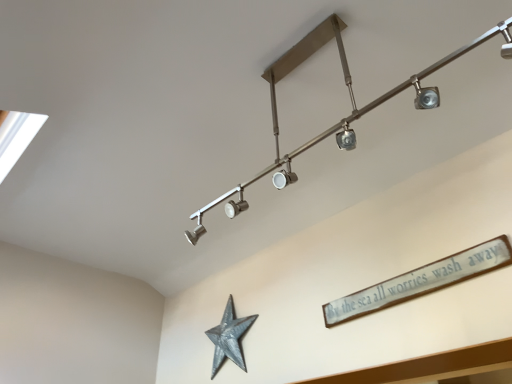
Question: Is the depth of galvanized metal star at lower center greater than that of satin nickel track light at upper center?

Choices:
 (A) yes
 (B) no

Answer: (A)

Question: Is galvanized metal star at lower center thinner than satin nickel track light at upper center?

Choices:
 (A) yes
 (B) no

Answer: (A)

Question: Does galvanized metal star at lower center turn towards satin nickel track light at upper center?

Choices:
 (A) yes
 (B) no

Answer: (B)

Question: From the image's perspective, is galvanized metal star at lower center above satin nickel track light at upper center?

Choices:
 (A) no
 (B) yes

Answer: (A)

Question: Does galvanized metal star at lower center appear on the left side of satin nickel track light at upper center?

Choices:
 (A) yes
 (B) no

Answer: (A)

Question: Would you say white wooden sign at upper right is to the left or to the right of satin nickel track light at upper center in the picture?

Choices:
 (A) left
 (B) right

Answer: (B)

Question: From the image's perspective, is white wooden sign at upper right positioned above or below satin nickel track light at upper center?

Choices:
 (A) above
 (B) below

Answer: (B)

Question: From a real-world perspective, is white wooden sign at upper right above or below satin nickel track light at upper center?

Choices:
 (A) below
 (B) above

Answer: (A)

Question: Is white wooden sign at upper right situated inside satin nickel track light at upper center or outside?

Choices:
 (A) outside
 (B) inside

Answer: (A)

Question: Based on their positions, is galvanized metal star at lower center located to the left or right of white wooden sign at upper right?

Choices:
 (A) left
 (B) right

Answer: (A)

Question: From the image's perspective, is galvanized metal star at lower center above or below white wooden sign at upper right?

Choices:
 (A) above
 (B) below

Answer: (B)

Question: Considering their positions, is galvanized metal star at lower center located in front of or behind white wooden sign at upper right?

Choices:
 (A) behind
 (B) front

Answer: (A)

Question: In terms of height, does galvanized metal star at lower center look taller or shorter compared to white wooden sign at upper right?

Choices:
 (A) tall
 (B) short

Answer: (A)

Question: Is satin nickel track light at upper center to the left or to the right of galvanized metal star at lower center in the image?

Choices:
 (A) left
 (B) right

Answer: (B)

Question: Do you think satin nickel track light at upper center is within galvanized metal star at lower center, or outside of it?

Choices:
 (A) outside
 (B) inside

Answer: (A)